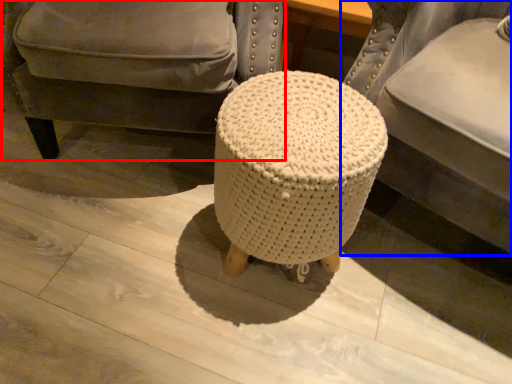
Question: Among these objects, which one is nearest to the camera, chair (highlighted by a red box) or furniture (highlighted by a blue box)?

Choices:
 (A) chair
 (B) furniture

Answer: (B)